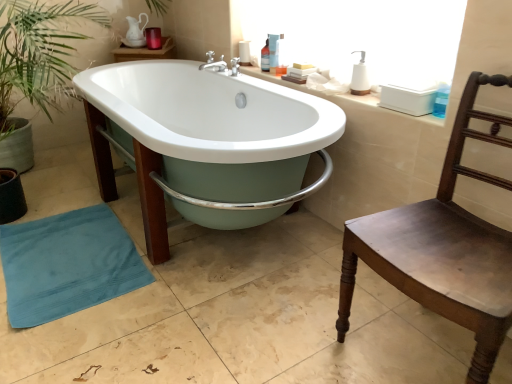
Question: Is white glossy bathtub at center inside translucent plastic bottle at upper center, placed as the 4th toiletry when sorted from front to back?

Choices:
 (A) no
 (B) yes

Answer: (A)

Question: Does translucent plastic bottle at upper center, placed as the 4th toiletry when sorted from front to back, have a smaller size compared to white glossy bathtub at center?

Choices:
 (A) yes
 (B) no

Answer: (A)

Question: Is translucent plastic bottle at upper center, which is the first toiletry from left to right, turned away from white glossy bathtub at center?

Choices:
 (A) no
 (B) yes

Answer: (A)

Question: From the image's perspective, would you say translucent plastic bottle at upper center, placed as the 4th toiletry when sorted from right to left, is shown under white glossy bathtub at center?

Choices:
 (A) yes
 (B) no

Answer: (B)

Question: Is translucent plastic bottle at upper center, placed as the 4th toiletry when sorted from front to back, thinner than white glossy bathtub at center?

Choices:
 (A) yes
 (B) no

Answer: (A)

Question: Looking at their shapes, would you say white glossy bathtub at center is wider or thinner than blue terry cloth beach towel at lower left?

Choices:
 (A) thin
 (B) wide

Answer: (B)

Question: Looking at the image, does white glossy bathtub at center seem bigger or smaller compared to blue terry cloth beach towel at lower left?

Choices:
 (A) big
 (B) small

Answer: (A)

Question: Would you say white glossy bathtub at center is to the left or to the right of blue terry cloth beach towel at lower left in the picture?

Choices:
 (A) right
 (B) left

Answer: (A)

Question: From a real-world perspective, is white glossy bathtub at center positioned above or below blue terry cloth beach towel at lower left?

Choices:
 (A) above
 (B) below

Answer: (A)

Question: Would you say white ceramic counter top at upper right is inside or outside translucent plastic bottle at upper center, which appears as the 1th toiletry when viewed from the back?

Choices:
 (A) inside
 (B) outside

Answer: (B)

Question: Is white ceramic counter top at upper right wider or thinner than translucent plastic bottle at upper center, placed as the 4th toiletry when sorted from front to back?

Choices:
 (A) thin
 (B) wide

Answer: (B)

Question: Visually, is white ceramic counter top at upper right positioned to the left or to the right of translucent plastic bottle at upper center, which appears as the 1th toiletry when viewed from the back?

Choices:
 (A) right
 (B) left

Answer: (A)

Question: From a real-world perspective, is white ceramic counter top at upper right above or below translucent plastic bottle at upper center, which appears as the 1th toiletry when viewed from the back?

Choices:
 (A) below
 (B) above

Answer: (A)

Question: From the image's perspective, is translucent plastic bottle at upper center, placed as the 4th toiletry when sorted from front to back, above or below white matte soap dispenser at upper right, the 4th toiletry positioned from the back?

Choices:
 (A) above
 (B) below

Answer: (A)

Question: Looking at the image, does translucent plastic bottle at upper center, placed as the 4th toiletry when sorted from front to back, seem bigger or smaller compared to white matte soap dispenser at upper right, the 1th toiletry when ordered from right to left?

Choices:
 (A) small
 (B) big

Answer: (A)